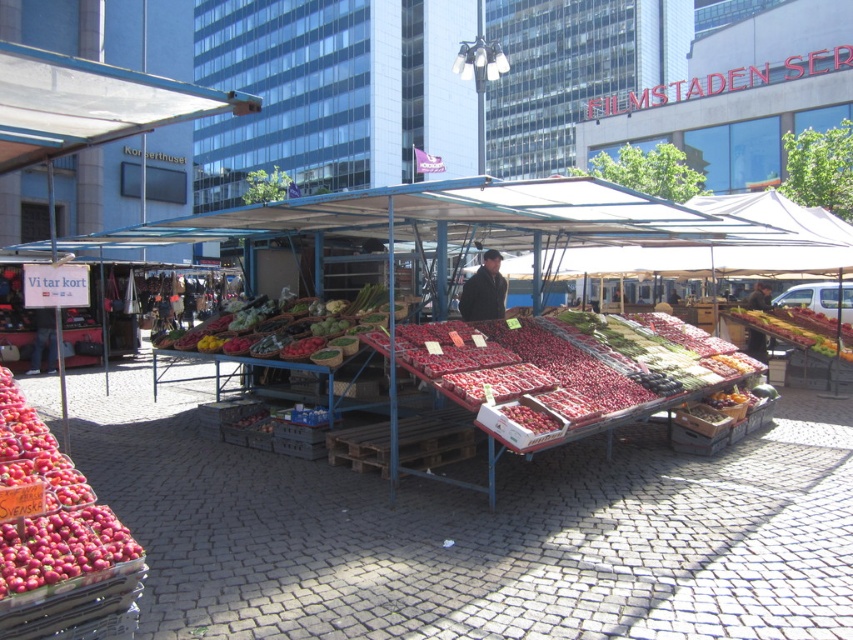
Between point (486, 179) and point (764, 316), which one is positioned in front?

Point (486, 179)

Who is lower down, shiny plastic strawberries at center or shiny red strawberries at center?

Positioned lower is shiny red strawberries at center.

I want to click on shiny plastic strawberries at center, so click(x=563, y=218).

Is point (463, 204) farther from camera compared to point (38, 472)?

Yes, it is.

Does point (672, 234) come behind point (6, 420)?

Yes, it is behind point (6, 420).

Identify the location of shiny plastic strawberries at center. The width and height of the screenshot is (853, 640). 563,218.

Which is below, shiny plastic strawberries at center or shiny red tomatoes at center?

shiny red tomatoes at center is below.

Is shiny plastic strawberries at center behind shiny red tomatoes at center?

No.

The height and width of the screenshot is (640, 853). I want to click on shiny plastic strawberries at center, so click(563, 218).

I want to click on shiny plastic strawberries at center, so click(x=563, y=218).